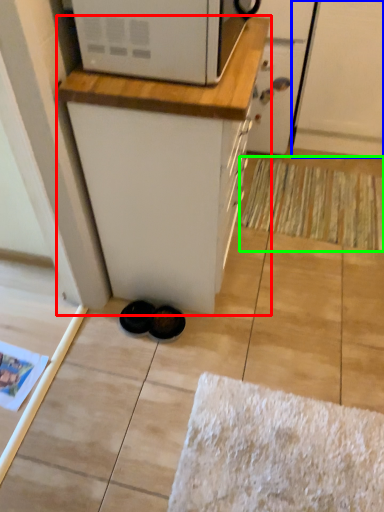
Question: Which object is the closest to the cabinetry (highlighted by a red box)? Choose among these: screen door (highlighted by a blue box) or doormat (highlighted by a green box).

Choices:
 (A) screen door
 (B) doormat

Answer: (B)